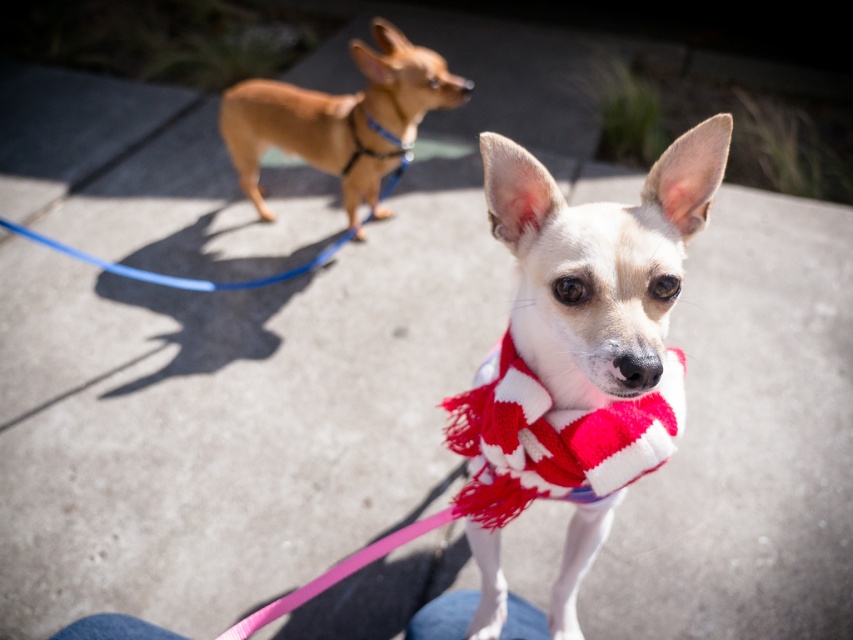
Question: Does white knitted scarf at center come behind blue rubber leash at upper left?

Choices:
 (A) no
 (B) yes

Answer: (A)

Question: Is white knitted scarf at center in front of blue rubber leash at upper left?

Choices:
 (A) no
 (B) yes

Answer: (B)

Question: Which object is farther from the camera taking this photo?

Choices:
 (A) red knitted scarf at center
 (B) white knitted scarf at center
 (C) pink fabric leash at center
 (D) blue rubber leash at upper left

Answer: (D)

Question: Which point appears farthest from the camera in this image?

Choices:
 (A) (498, 486)
 (B) (33, 234)

Answer: (B)

Question: Does white knitted scarf at center have a lesser width compared to blue rubber leash at upper left?

Choices:
 (A) yes
 (B) no

Answer: (A)

Question: Which object is farther from the camera taking this photo?

Choices:
 (A) light brown fur at upper left
 (B) pink fabric leash at center

Answer: (A)